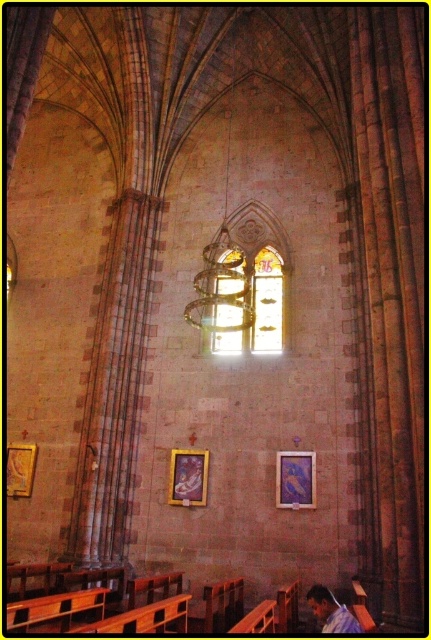
Question: Does matte gold picture frame at center come behind gold-framed painting at center?

Choices:
 (A) yes
 (B) no

Answer: (B)

Question: Which object appears closest to the camera in this image?

Choices:
 (A) gold-framed painting at center
 (B) gold-framed picture at left
 (C) matte gold picture frame at center

Answer: (C)

Question: Can you confirm if matte gold picture frame at center is positioned below gold-framed picture at left?

Choices:
 (A) no
 (B) yes

Answer: (B)

Question: Which object is the closest to the gold-framed painting at center?

Choices:
 (A) gold-framed picture at left
 (B) matte gold picture frame at center

Answer: (B)

Question: Considering the real-world distances, which object is farthest from the gold-framed painting at center?

Choices:
 (A) matte gold picture frame at center
 (B) gold-framed picture at left

Answer: (B)

Question: Does gold-framed painting at center appear on the left side of gold-framed picture at left?

Choices:
 (A) no
 (B) yes

Answer: (A)